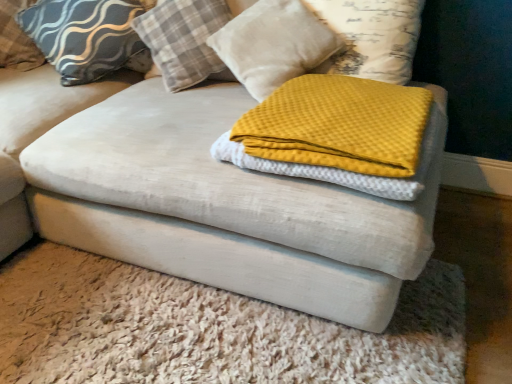
Question: Could you tell me if plaid fabric pillow at upper center, marked as the 2th pillow in a right-to-left arrangement, is facing textured gray pillow at upper left, which appears as the 4th pillow when viewed from the right?

Choices:
 (A) no
 (B) yes

Answer: (A)

Question: Can you confirm if plaid fabric pillow at upper center, the third pillow viewed from the left, is positioned to the right of textured gray pillow at upper left, which appears as the 4th pillow when viewed from the right?

Choices:
 (A) no
 (B) yes

Answer: (B)

Question: Can you confirm if plaid fabric pillow at upper center, marked as the 2th pillow in a right-to-left arrangement, is bigger than textured gray pillow at upper left, which appears as the 4th pillow when viewed from the right?

Choices:
 (A) no
 (B) yes

Answer: (B)

Question: Would you say textured gray pillow at upper left, which appears as the 4th pillow when viewed from the right, is part of plaid fabric pillow at upper center, marked as the 2th pillow in a right-to-left arrangement,'s contents?

Choices:
 (A) no
 (B) yes

Answer: (A)

Question: Considering the relative positions of plaid fabric pillow at upper center, the third pillow viewed from the left, and textured gray pillow at upper left, which is the first pillow from left to right, in the image provided, is plaid fabric pillow at upper center, the third pillow viewed from the left, behind textured gray pillow at upper left, which is the first pillow from left to right,?

Choices:
 (A) yes
 (B) no

Answer: (B)

Question: Is plaid fabric pillow at upper center, marked as the 2th pillow in a right-to-left arrangement, wider than textured gray pillow at upper left, which appears as the 4th pillow when viewed from the right?

Choices:
 (A) yes
 (B) no

Answer: (A)

Question: Is matte gray pillow at upper left, the 3th pillow when ordered from right to left, taller than yellow waffle knit blanket at center?

Choices:
 (A) no
 (B) yes

Answer: (B)

Question: Is matte gray pillow at upper left, the 3th pillow when ordered from right to left, placed right next to yellow waffle knit blanket at center?

Choices:
 (A) yes
 (B) no

Answer: (B)

Question: Does matte gray pillow at upper left, the second pillow in the left-to-right sequence, have a lesser height compared to yellow waffle knit blanket at center?

Choices:
 (A) yes
 (B) no

Answer: (B)

Question: Is matte gray pillow at upper left, the second pillow in the left-to-right sequence, to the left of yellow waffle knit blanket at center from the viewer's perspective?

Choices:
 (A) no
 (B) yes

Answer: (B)

Question: From the image's perspective, is matte gray pillow at upper left, the 3th pillow when ordered from right to left, on yellow waffle knit blanket at center?

Choices:
 (A) no
 (B) yes

Answer: (B)

Question: Is matte gray pillow at upper left, the second pillow in the left-to-right sequence, turned away from yellow waffle knit blanket at center?

Choices:
 (A) no
 (B) yes

Answer: (A)

Question: Is yellow waffle knit blanket at center not inside velvet ottoman at center?

Choices:
 (A) yes
 (B) no

Answer: (A)